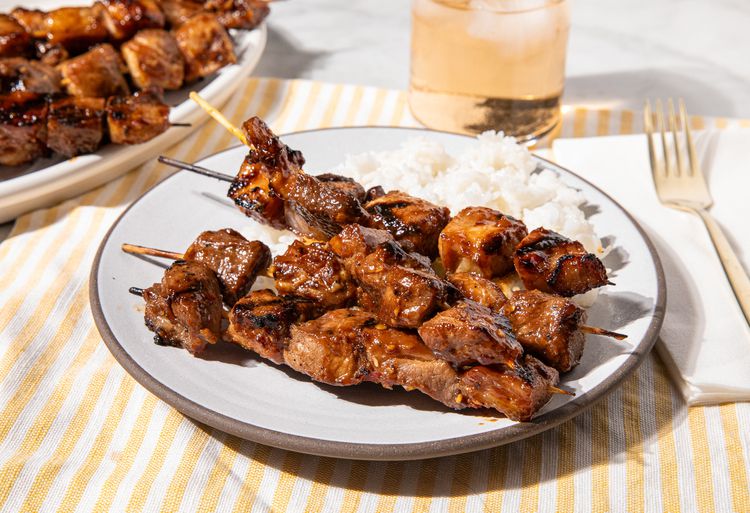
Find the location of a particular element. This screenshot has width=750, height=513. tablecloth is located at coordinates (655, 436), (58, 412).